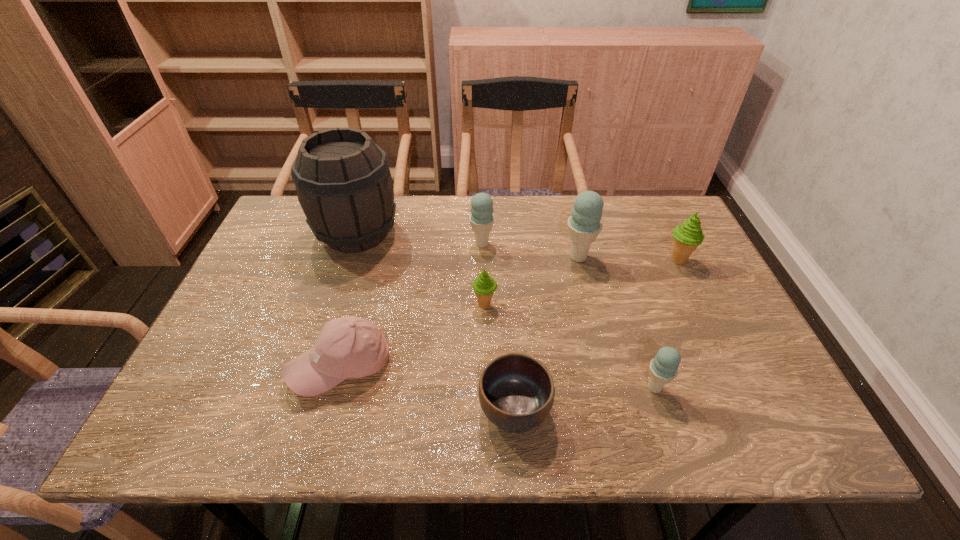
The image size is (960, 540). I want to click on ice cream located in the far edge section of the desktop, so click(481, 218).

The image size is (960, 540). What are the coordinates of `baseball cap that is positioned at the near edge` in the screenshot? It's located at (349, 347).

In order to click on bowl present at the near edge in this screenshot , I will do (x=516, y=391).

This screenshot has width=960, height=540. What are the coordinates of `object that is at the left edge` in the screenshot? It's located at (343, 182).

Identify the location of object situated at the right edge. (688, 236).

Find the location of a particular element. The image size is (960, 540). object present at the far left corner is located at coordinates (343, 182).

The image size is (960, 540). I want to click on vacant space at the far edge of the desktop, so click(606, 214).

You are a GUI agent. You are given a task and a screenshot of the screen. Output one action in this format:
    pyautogui.click(x=<x>, y=<y>)
    Task: Click on the vacant space at the near edge
    This screenshot has width=960, height=540.
    Given the screenshot: What is the action you would take?
    pyautogui.click(x=252, y=427)

Where is `vacant area at the right edge of the desktop`? The image size is (960, 540). vacant area at the right edge of the desktop is located at coordinates (723, 294).

Where is `vacant space at the far left corner`? The image size is (960, 540). vacant space at the far left corner is located at coordinates (296, 211).